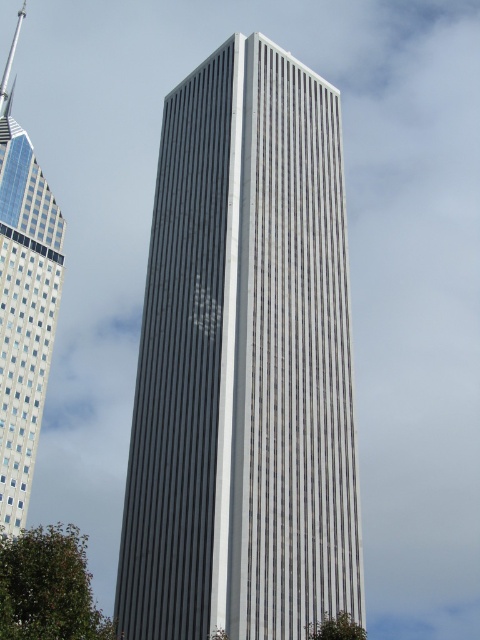
Question: Which point appears farthest from the camera in this image?

Choices:
 (A) (38, 369)
 (B) (278, 449)

Answer: (A)

Question: Which point appears closest to the camera in this image?

Choices:
 (A) (17, 529)
 (B) (300, 508)

Answer: (B)

Question: Which of the following is the closest to the observer?

Choices:
 (A) glassy reflective skyscraper at left
 (B) gray/white glass skyscraper at center

Answer: (B)

Question: Can you confirm if gray/white glass skyscraper at center is positioned to the left of glassy reflective skyscraper at left?

Choices:
 (A) yes
 (B) no

Answer: (B)

Question: Can you confirm if gray/white glass skyscraper at center is positioned above glassy reflective skyscraper at left?

Choices:
 (A) no
 (B) yes

Answer: (A)

Question: Can you confirm if gray/white glass skyscraper at center is smaller than glassy reflective skyscraper at left?

Choices:
 (A) yes
 (B) no

Answer: (B)